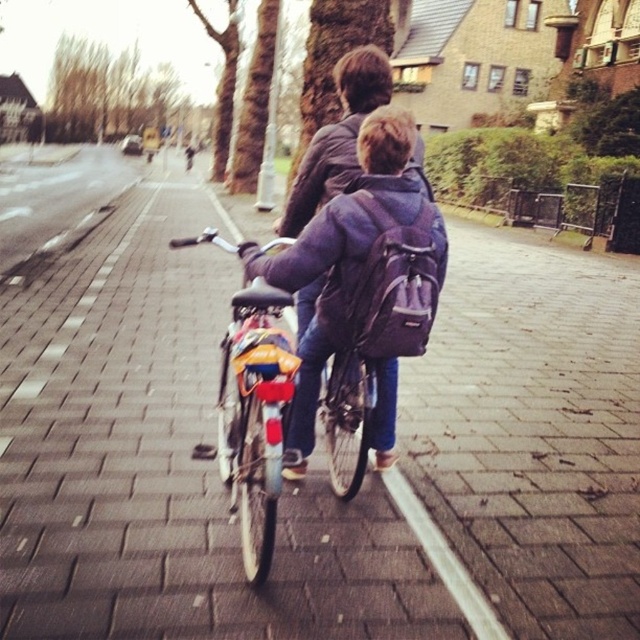
Describe the element at coordinates (253, 417) in the screenshot. I see `metallic silver bicycle at center` at that location.

Is metallic silver bicycle at center to the right of purple fabric backpack at center from the viewer's perspective?

In fact, metallic silver bicycle at center is to the left of purple fabric backpack at center.

Is point (244, 408) positioned in front of point (301, 378)?

Yes, it is in front of point (301, 378).

You are a GUI agent. You are given a task and a screenshot of the screen. Output one action in this format:
    pyautogui.click(x=<x>, y=<y>)
    Task: Click on the metallic silver bicycle at center
    Image resolution: width=640 pixels, height=640 pixels.
    Given the screenshot: What is the action you would take?
    pyautogui.click(x=253, y=417)